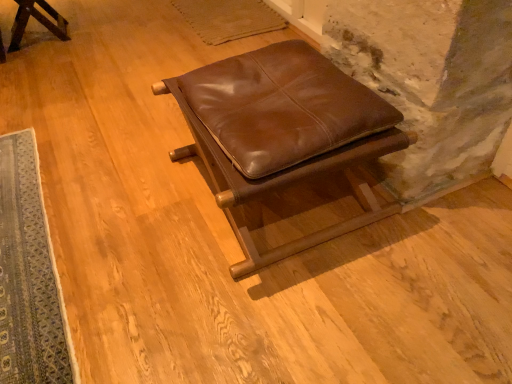
At what (x,y) coordinates should I click in order to perform the action: click on free location above blue woven rug at lower left (from a real-world perspective). Please return your answer as a coordinate pair (x, y). Looking at the image, I should click on click(x=24, y=230).